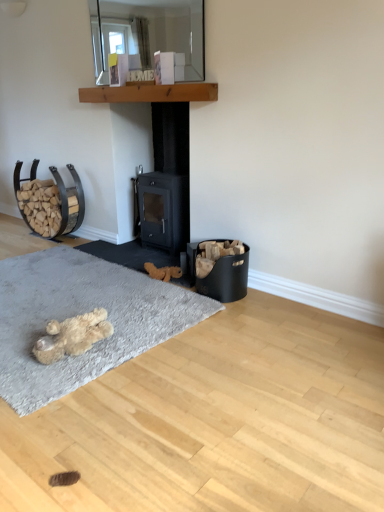
The image size is (384, 512). I want to click on vacant point to the right of fuzzy beige teddy bear at lower left, the 1th animal positioned from the left, so click(143, 335).